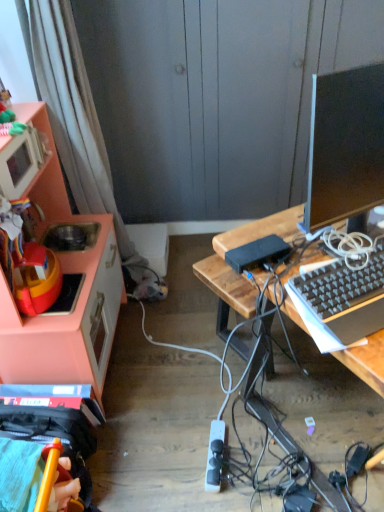
Locate an element on the screen. free location to the left of white plastic power outlet at lower center is located at coordinates (163, 457).